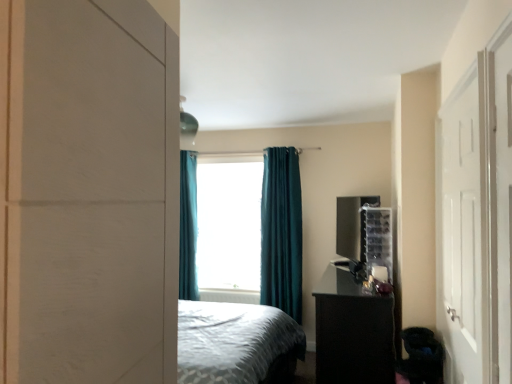
Question: From the image's perspective, is teal fabric curtain at center, which is the 1th curtain in right-to-left order, located above or below white plastic radiator at center?

Choices:
 (A) below
 (B) above

Answer: (B)

Question: From a real-world perspective, is teal fabric curtain at center, placed as the first curtain when sorted from front to back, above or below white plastic radiator at center?

Choices:
 (A) below
 (B) above

Answer: (B)

Question: Estimate the real-world distances between objects in this image. Which object is farther from the teal fabric curtain at center, arranged as the 2th curtain when viewed from the left?

Choices:
 (A) teal fabric curtain at left, the 2th curtain when ordered from front to back
 (B) teal curtain at center
 (C) black glossy nightstand at lower right
 (D) white plastic radiator at center
 (E) white matte door at right

Answer: (E)

Question: Estimate the real-world distances between objects in this image. Which object is farther from the teal fabric curtain at left, which ranks as the first curtain in left-to-right order?

Choices:
 (A) teal curtain at center
 (B) teal fabric curtain at center, arranged as the 2th curtain when viewed from the left
 (C) white plastic radiator at center
 (D) clear plastic organizer at right
 (E) white matte door at right

Answer: (E)